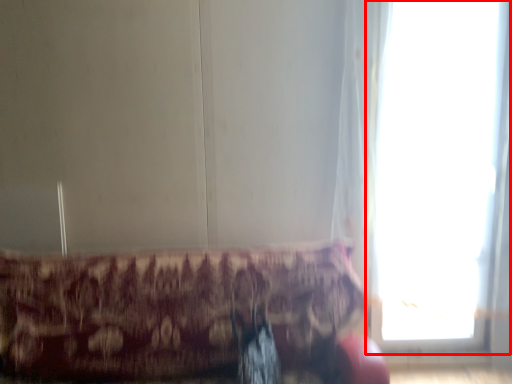
Question: From the image's perspective, where is window (annotated by the red box) located in relation to furniture in the image?

Choices:
 (A) above
 (B) below

Answer: (A)